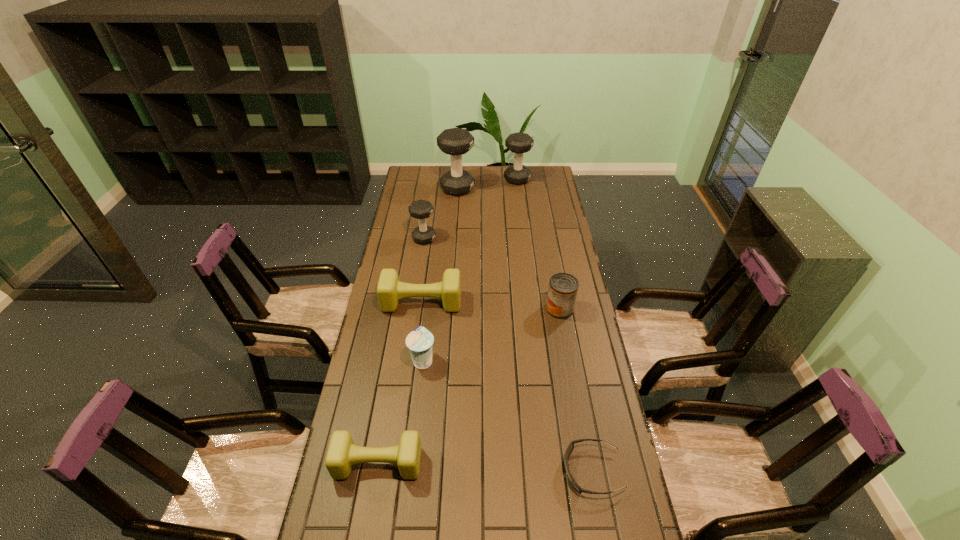
This screenshot has height=540, width=960. What are the coordinates of `the tallest dumbbell` in the screenshot? It's located at (455, 141).

In order to click on the tallest object in this screenshot , I will do `click(455, 141)`.

Image resolution: width=960 pixels, height=540 pixels. What are the coordinates of `the second tallest object` in the screenshot? It's located at (518, 143).

Locate an element on the screen. The height and width of the screenshot is (540, 960). the second smallest gray dumbbell is located at coordinates point(518,143).

Find the location of a particular element. The height and width of the screenshot is (540, 960). the third nearest dumbbell is located at coordinates (421, 209).

Identify the location of the sixth shortest object. The image size is (960, 540). (421, 209).

You are a GUI agent. You are given a task and a screenshot of the screen. Output one action in this format:
    pyautogui.click(x=<x>, y=<y>)
    Task: Click on the can
    This screenshot has width=960, height=540.
    Given the screenshot: What is the action you would take?
    pyautogui.click(x=563, y=287)

Find the location of `the second nearest dumbbell`. the second nearest dumbbell is located at coordinates (390, 290).

The height and width of the screenshot is (540, 960). I want to click on the bigger olive dumbbell, so click(x=390, y=290).

Find the location of a particular element. The image size is (960, 540). the third nearest object is located at coordinates pyautogui.click(x=419, y=341).